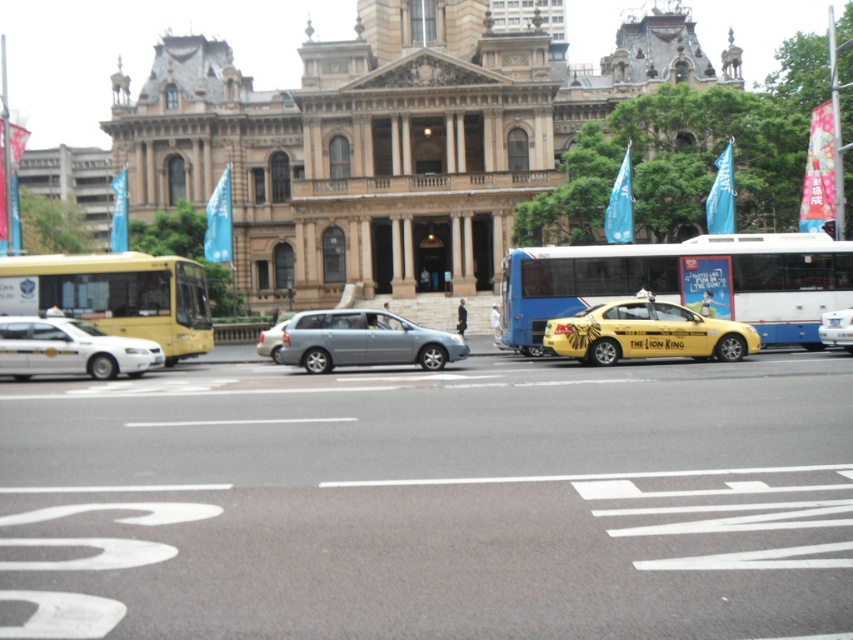
Question: Does yellow matte bus at left have a greater width compared to yellow matte taxi at center?

Choices:
 (A) yes
 (B) no

Answer: (A)

Question: Which object appears farthest from the camera in this image?

Choices:
 (A) yellow matte bus at left
 (B) satin silver sedan at center

Answer: (A)

Question: Among these points, which one is farthest from the camera?

Choices:
 (A) (289, 337)
 (B) (825, 326)
 (C) (259, 339)
 (D) (688, 326)

Answer: (C)

Question: Estimate the real-world distances between objects in this image. Which object is closer to the yellow matte bus at left?

Choices:
 (A) yellow matte taxi at center
 (B) satin silver van at center
 (C) white glossy sedan at left

Answer: (C)

Question: Does yellow matte bus at left appear over satin silver sedan at center?

Choices:
 (A) yes
 (B) no

Answer: (A)

Question: Is blue metallic bus at center positioned in front of yellow matte bus at left?

Choices:
 (A) yes
 (B) no

Answer: (A)